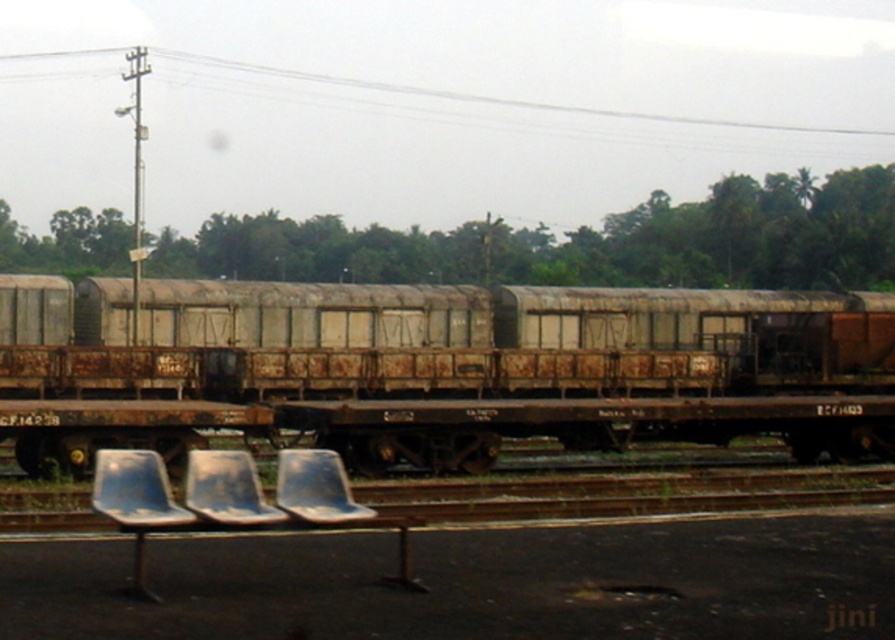
Question: Which object is positioned closest to the rusty metal train car at center?

Choices:
 (A) white plastic chair at lower center
 (B) metallic gray chair at lower center
 (C) blue plastic chair at lower left

Answer: (A)

Question: Does rusty metal train car at center appear on the left side of metallic gray chair at lower center?

Choices:
 (A) no
 (B) yes

Answer: (A)

Question: Which is farther from the rusty metal train car at center?

Choices:
 (A) blue plastic chair at lower left
 (B) white plastic chair at lower center

Answer: (A)

Question: Is rusty metal train car at center to the left of metallic gray chair at lower center from the viewer's perspective?

Choices:
 (A) no
 (B) yes

Answer: (A)

Question: Which point is closer to the camera?

Choices:
 (A) rusty metal train car at center
 (B) metallic gray chair at lower center
 (C) blue plastic chair at lower left
 (D) white plastic chair at lower center

Answer: (C)

Question: Can you confirm if blue plastic chair at lower left is smaller than metallic gray chair at lower center?

Choices:
 (A) no
 (B) yes

Answer: (A)